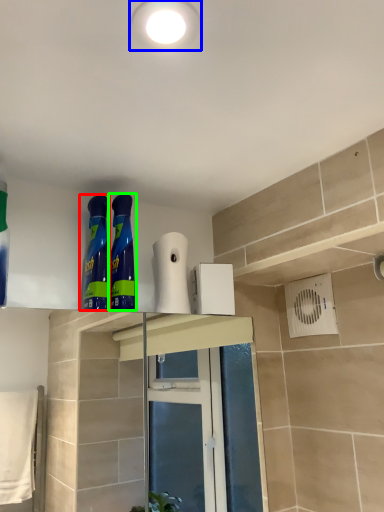
Question: Considering the real-world distances, which object is closest to cleaning product (highlighted by a red box)? lighting (highlighted by a blue box) or cleaning product (highlighted by a green box).

Choices:
 (A) lighting
 (B) cleaning product

Answer: (B)